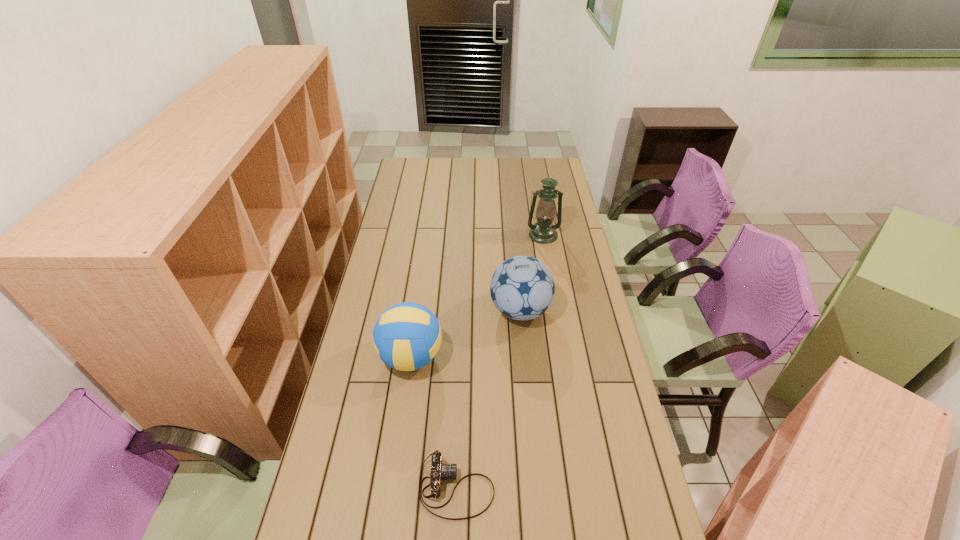
Locate an element on the screen. the tallest object is located at coordinates (543, 231).

Locate an element on the screen. oil lamp is located at coordinates (543, 231).

Identify the location of soccer ball. (522, 288).

Locate an element on the screen. volleyball is located at coordinates (407, 336).

At what (x,y) coordinates should I click in order to perform the action: click on the shortest object. Please return your answer as a coordinate pair (x, y). The image size is (960, 540). Looking at the image, I should click on (439, 471).

The width and height of the screenshot is (960, 540). Find the location of `camera`. camera is located at coordinates (439, 471).

This screenshot has width=960, height=540. Identify the location of vacant area located 0.220m on the left of the oil lamp. (478, 235).

The height and width of the screenshot is (540, 960). I want to click on free space located on the side with brand of the soccer ball, so click(x=463, y=310).

The image size is (960, 540). What are the coordinates of `free space located 0.310m on the side with brand of the soccer ball` in the screenshot? It's located at (407, 310).

I want to click on free space located 0.310m on the side with brand of the soccer ball, so click(407, 310).